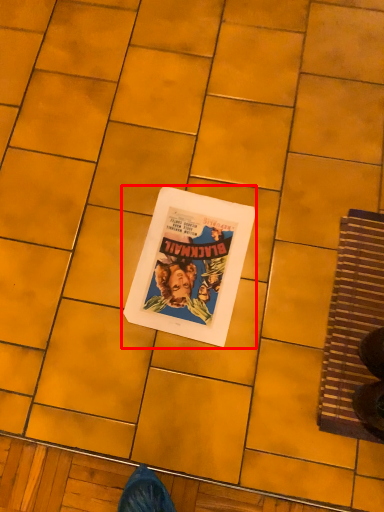
Question: In this image, where is paperback book (annotated by the red box) located relative to doormat?

Choices:
 (A) left
 (B) right

Answer: (A)